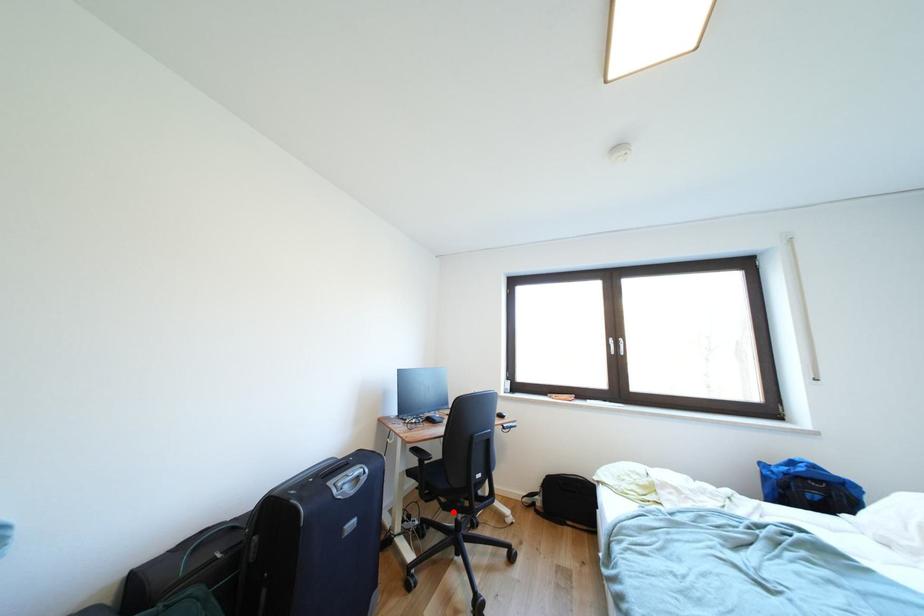
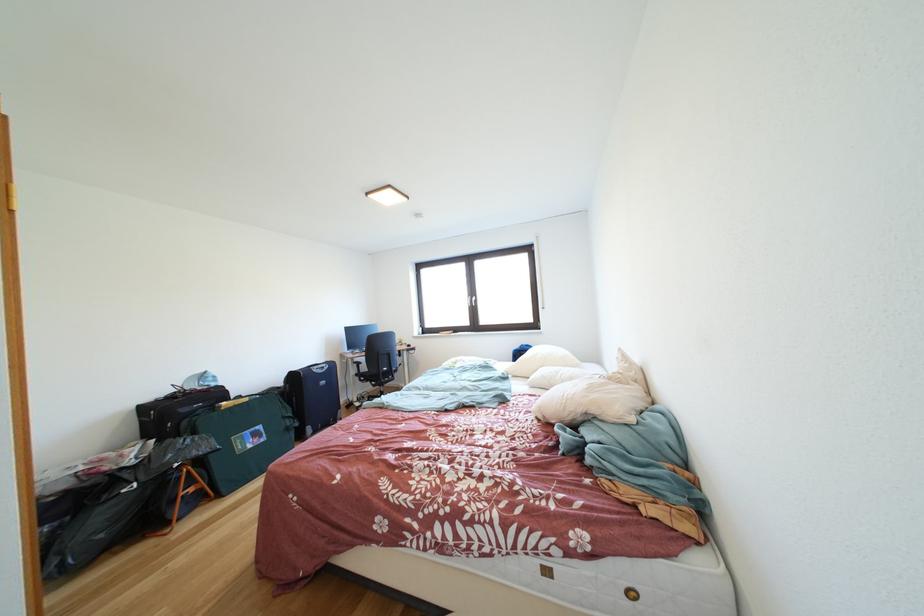
Question: I am providing you with two images of the same scene from different viewpoints. A red point is shown in image1. For the corresponding object point in image2, is it positioned nearer or farther from the camera?

Choices:
 (A) Nearer
 (B) Farther

Answer: (A)